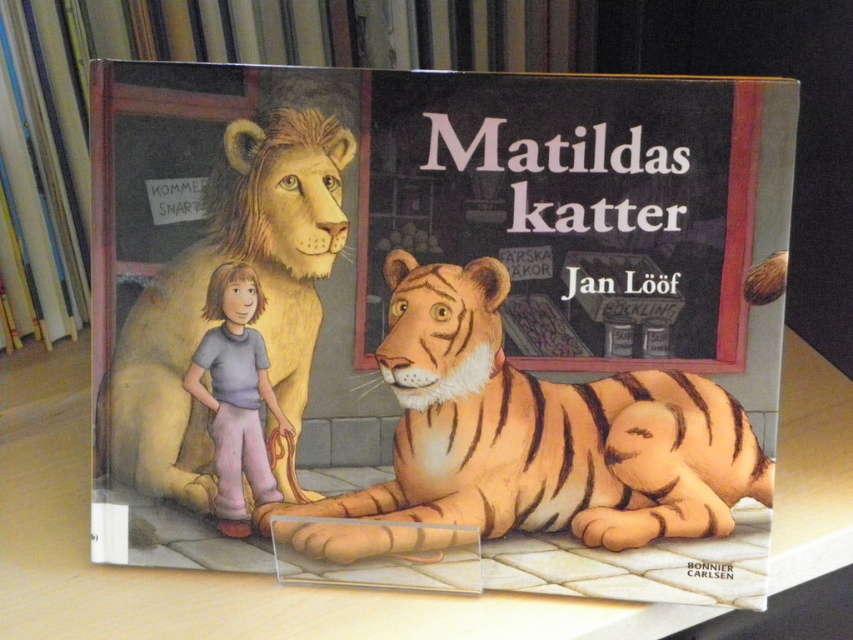
Which is behind, point (320, 259) or point (469, 522)?

The point (469, 522) is more distant.

The height and width of the screenshot is (640, 853). Describe the element at coordinates (447, 317) in the screenshot. I see `matte paper book cover at center` at that location.

Locate an element on the screen. The image size is (853, 640). matte paper book cover at center is located at coordinates (447, 317).

The width and height of the screenshot is (853, 640). What are the coordinates of `matte paper book cover at center` in the screenshot? It's located at (447, 317).

From the picture: Between matte paper book cover at center and beige fur lion at left, which one appears on the right side from the viewer's perspective?

Positioned to the right is matte paper book cover at center.

Who is more forward, (439, 170) or (109, 388)?

Point (439, 170) is in front.

The width and height of the screenshot is (853, 640). I want to click on matte paper book cover at center, so click(447, 317).

Consider the image. Is orange striped tiger at center taller than beige fur lion at left?

No, orange striped tiger at center is not taller than beige fur lion at left.

Between orange striped tiger at center and beige fur lion at left, which one has less height?

orange striped tiger at center

Is point (521, 516) behind point (286, 358)?

No, (521, 516) is closer to viewer.

Identify the location of orange striped tiger at center. This screenshot has height=640, width=853. pyautogui.click(x=540, y=432).